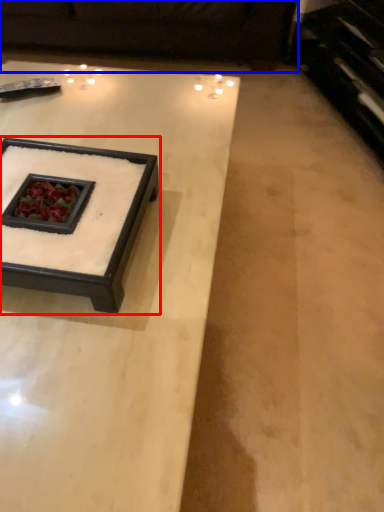
Question: Among these objects, which one is farthest to the camera, coffee table (highlighted by a red box) or couch (highlighted by a blue box)?

Choices:
 (A) coffee table
 (B) couch

Answer: (B)